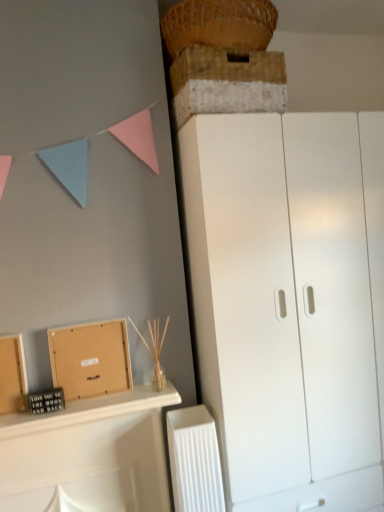
This screenshot has width=384, height=512. In order to click on free space in front of brown cardboard box at lower left in this screenshot , I will do `click(77, 404)`.